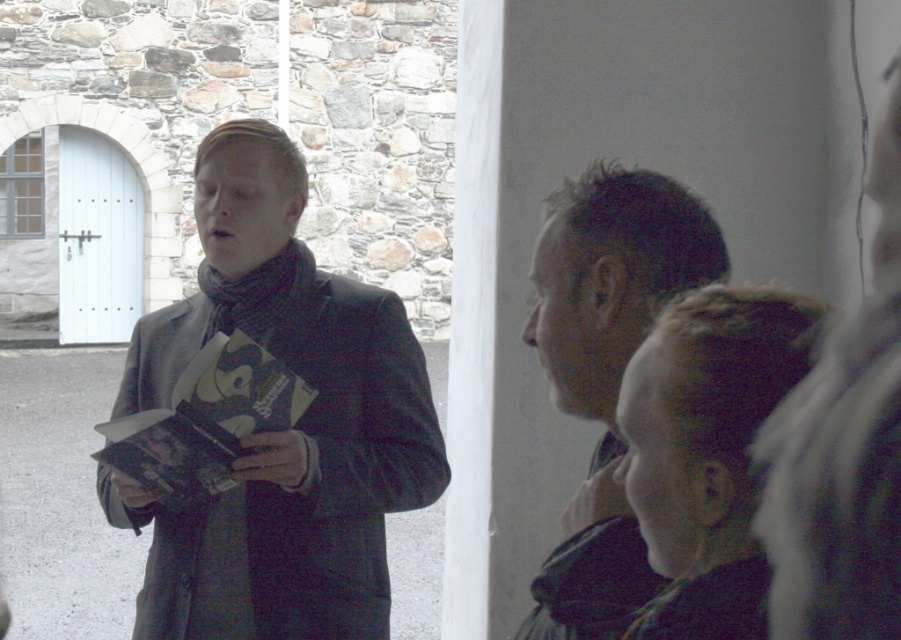
You are standing in front of the stone building and want to walk from point A to point B. Point A is at coordinate point [554,250] and point B is at coordinate point [537,605]. Which point is closer to you when you start walking?

Point A at coordinate point [554,250] is closer to you because it is further to the viewer than point B at coordinate point [537,605].

You are standing in front of the stone building with the light blue door. You see a matte black jacket at left and a dark brown hair at center. Which object is closer to the ground?

The matte black jacket at left is positioned under dark brown hair at center, so the matte black jacket at left is closer to the ground.